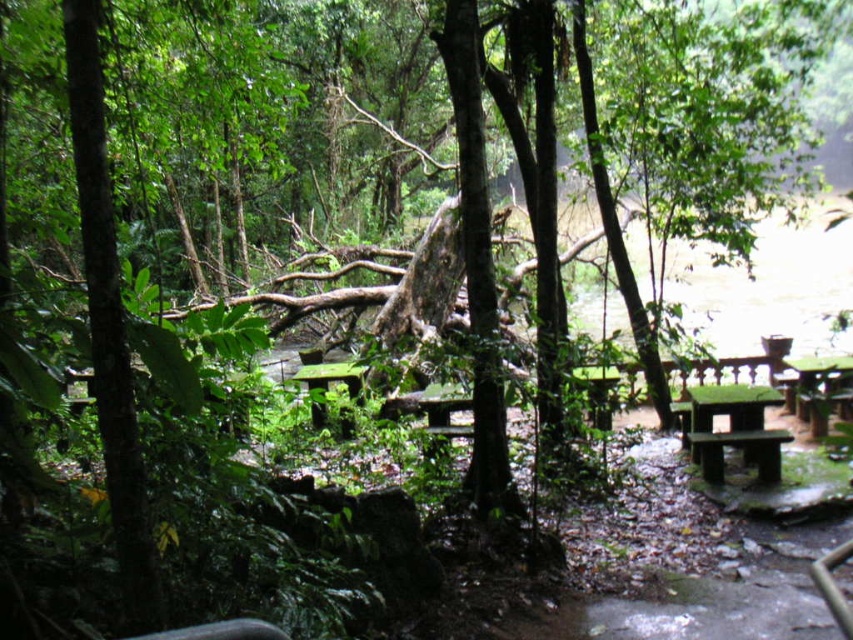
Does green mossy bench at lower right have a larger size compared to green matte table at right?

Incorrect, green mossy bench at lower right is not larger than green matte table at right.

Is point (744, 404) positioned behind point (799, 380)?

No, (744, 404) is closer to viewer.

This screenshot has height=640, width=853. What do you see at coordinates (735, 429) in the screenshot? I see `green mossy bench at lower right` at bounding box center [735, 429].

Locate an element on the screen. Image resolution: width=853 pixels, height=640 pixels. green mossy bench at lower right is located at coordinates (735, 429).

Is green matte table at right further to the viewer compared to green mossy table at center?

No, green matte table at right is closer to the viewer.

The height and width of the screenshot is (640, 853). Describe the element at coordinates (819, 387) in the screenshot. I see `green matte table at right` at that location.

This screenshot has height=640, width=853. What are the coordinates of `green matte table at right` in the screenshot? It's located at (819, 387).

Which is behind, point (747, 429) or point (358, 378)?

Point (358, 378)

Does green mossy bench at lower right have a greater width compared to green mossy table at center?

Yes, green mossy bench at lower right is wider than green mossy table at center.

Where is `green mossy bench at lower right`? This screenshot has height=640, width=853. green mossy bench at lower right is located at coordinates (735, 429).